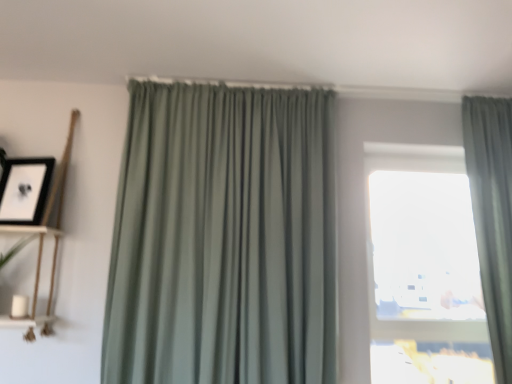
Question: Can you confirm if wooden shelf at left, which is the second shelf from bottom to top, is smaller than white matte shelf at left, placed as the first shelf when sorted from bottom to top?

Choices:
 (A) no
 (B) yes

Answer: (A)

Question: Is wooden shelf at left, which appears as the 1th shelf when viewed from the top, facing towards white matte shelf at left, acting as the 2th shelf starting from the top?

Choices:
 (A) yes
 (B) no

Answer: (A)

Question: Does wooden shelf at left, which is the second shelf from bottom to top, have a greater width compared to white matte shelf at left, acting as the 2th shelf starting from the top?

Choices:
 (A) no
 (B) yes

Answer: (A)

Question: Does wooden shelf at left, which is the second shelf from bottom to top, have a greater height compared to white matte shelf at left, placed as the first shelf when sorted from bottom to top?

Choices:
 (A) no
 (B) yes

Answer: (B)

Question: Are wooden shelf at left, which appears as the 1th shelf when viewed from the top, and white matte shelf at left, acting as the 2th shelf starting from the top, making contact?

Choices:
 (A) no
 (B) yes

Answer: (B)

Question: From the image's perspective, is sage green drapery at right, which appears as the first curtain when viewed from the right, positioned above or below black matte picture frame at upper left?

Choices:
 (A) below
 (B) above

Answer: (A)

Question: Based on their sizes in the image, would you say sage green drapery at right, which is the 2th curtain from left to right, is bigger or smaller than black matte picture frame at upper left?

Choices:
 (A) big
 (B) small

Answer: (A)

Question: Choose the correct answer: Is sage green drapery at right, which appears as the first curtain when viewed from the right, inside black matte picture frame at upper left or outside it?

Choices:
 (A) inside
 (B) outside

Answer: (B)

Question: From a real-world perspective, relative to black matte picture frame at upper left, is sage green drapery at right, which is the 2th curtain from left to right, vertically above or below?

Choices:
 (A) above
 (B) below

Answer: (B)

Question: Is sage green fabric curtain at center, the first curtain when ordered from left to right, in front of or behind white matte shelf at left, placed as the first shelf when sorted from bottom to top, in the image?

Choices:
 (A) front
 (B) behind

Answer: (A)

Question: In the image, is sage green fabric curtain at center, positioned as the 2th curtain in right-to-left order, on the left side or the right side of white matte shelf at left, acting as the 2th shelf starting from the top?

Choices:
 (A) right
 (B) left

Answer: (A)

Question: Considering the positions of sage green fabric curtain at center, the first curtain when ordered from left to right, and white matte shelf at left, acting as the 2th shelf starting from the top, in the image, is sage green fabric curtain at center, the first curtain when ordered from left to right, taller or shorter than white matte shelf at left, acting as the 2th shelf starting from the top,?

Choices:
 (A) short
 (B) tall

Answer: (B)

Question: Considering the positions of point [x=138, y=228] and point [x=0, y=316], is point [x=138, y=228] closer or farther from the camera than point [x=0, y=316]?

Choices:
 (A) farther
 (B) closer

Answer: (A)

Question: Is white matte shelf at left, placed as the first shelf when sorted from bottom to top, to the left or to the right of transparent glass window at center in the image?

Choices:
 (A) left
 (B) right

Answer: (A)

Question: Considering the positions of point (44, 332) and point (401, 296), is point (44, 332) closer or farther from the camera than point (401, 296)?

Choices:
 (A) farther
 (B) closer

Answer: (B)